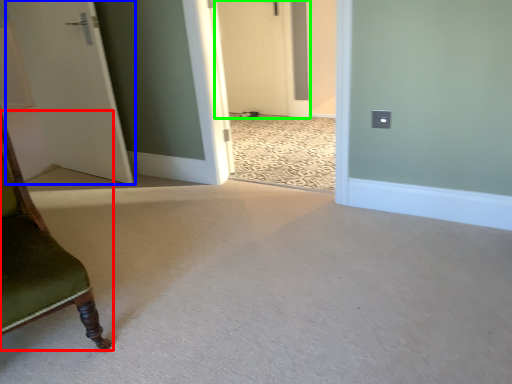
Question: Considering the real-world distances, which object is closest to furniture (highlighted by a red box)? door (highlighted by a blue box) or door (highlighted by a green box).

Choices:
 (A) door
 (B) door

Answer: (A)